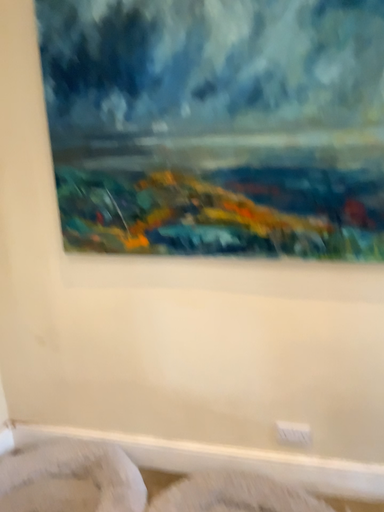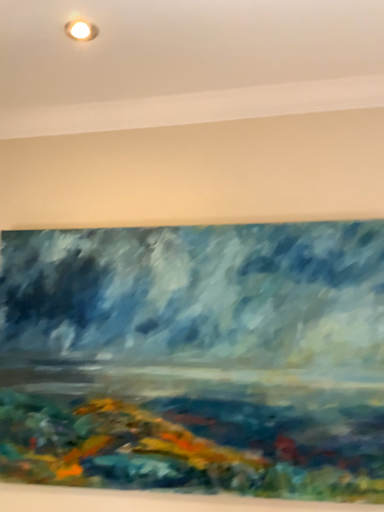
Question: How did the camera likely rotate when shooting the video?

Choices:
 (A) rotated upward
 (B) rotated downward

Answer: (A)